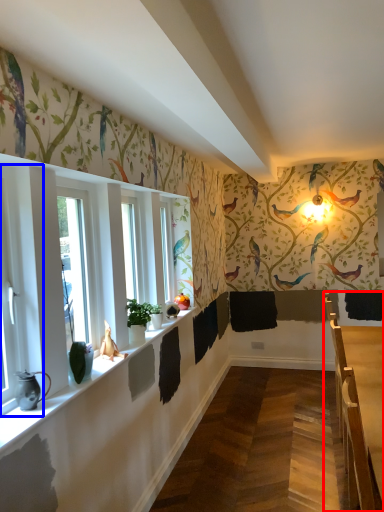
Question: Among these objects, which one is nearest to the camera, table (highlighted by a red box) or window (highlighted by a blue box)?

Choices:
 (A) table
 (B) window

Answer: (B)